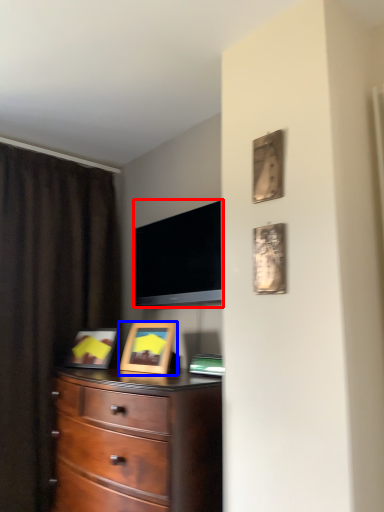
Question: Which object appears farthest to the camera in this image, television (highlighted by a red box) or picture frame (highlighted by a blue box)?

Choices:
 (A) television
 (B) picture frame

Answer: (B)